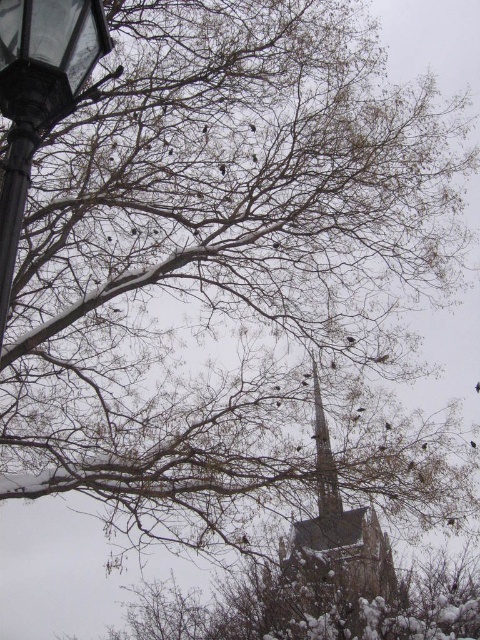
Who is higher up, black metal street light at upper left or black matte bird at upper center?

Positioned higher is black metal street light at upper left.

In the scene shown: Does black metal street light at upper left have a lesser height compared to black matte bird at upper center?

No.

Is point (34, 38) farther from camera compared to point (476, 448)?

No, (34, 38) is closer to viewer.

Identify the location of black metal street light at upper left. (39, 96).

Is snow-covered stone church steeple at center to the left of black metal street light at upper left from the viewer's perspective?

Incorrect, snow-covered stone church steeple at center is not on the left side of black metal street light at upper left.

Which is in front, point (344, 616) or point (63, 76)?

Positioned in front is point (63, 76).

Which is behind, point (377, 545) or point (17, 58)?

Positioned behind is point (377, 545).

This screenshot has width=480, height=640. Find the location of `snow-covered stone church steeple at center`. snow-covered stone church steeple at center is located at coordinates (330, 561).

Is smooth stone spire at center below black matte bird at upper center?

No.

Which is more to the left, smooth stone spire at center or black matte bird at upper center?

smooth stone spire at center

In the scene shown: Who is more forward, (324,422) or (471,440)?

Point (324,422)

This screenshot has width=480, height=640. I want to click on smooth stone spire at center, so pos(324,458).